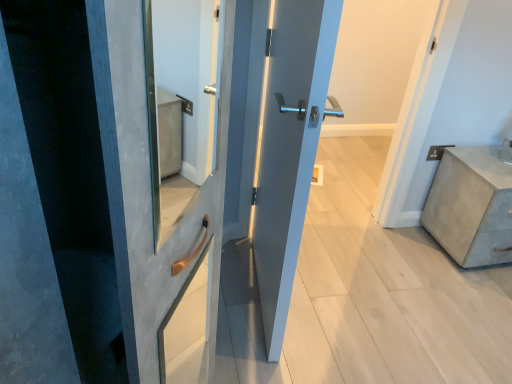
Locate an element on the screen. satin blue door at center is located at coordinates click(289, 146).

What do you see at coordinates (289, 146) in the screenshot? This screenshot has width=512, height=384. I see `satin blue door at center` at bounding box center [289, 146].

What is the approximate height of satin blue door at center?

4.20 feet.

This screenshot has width=512, height=384. Describe the element at coordinates (471, 206) in the screenshot. I see `concrete textured chest of drawers at right` at that location.

The image size is (512, 384). I want to click on concrete textured chest of drawers at right, so click(x=471, y=206).

At what (x,y) coordinates should I click in order to perform the action: click on satin blue door at center. Please return your answer as a coordinate pair (x, y). This screenshot has width=512, height=384. Looking at the image, I should click on (289, 146).

Considering the relative positions of concrete textured chest of drawers at right and satin blue door at center in the image provided, is concrete textured chest of drawers at right to the right of satin blue door at center from the viewer's perspective?

Yes.

Between concrete textured chest of drawers at right and satin blue door at center, which one is positioned behind?

Positioned behind is concrete textured chest of drawers at right.

Is point (443, 206) closer to camera compared to point (262, 148)?

No, (443, 206) is behind (262, 148).

From the image's perspective, relative to satin blue door at center, is concrete textured chest of drawers at right above or below?

concrete textured chest of drawers at right is below satin blue door at center.

From a real-world perspective, which object stands above the other?

In real-world perspective, satin blue door at center is above.

Can you confirm if concrete textured chest of drawers at right is thinner than satin blue door at center?

Incorrect, the width of concrete textured chest of drawers at right is not less than that of satin blue door at center.

Between concrete textured chest of drawers at right and satin blue door at center, which one has more height?

satin blue door at center is taller.

Does concrete textured chest of drawers at right have a smaller size compared to satin blue door at center?

No, concrete textured chest of drawers at right is not smaller than satin blue door at center.

Is concrete textured chest of drawers at right located outside satin blue door at center?

Yes, concrete textured chest of drawers at right is outside of satin blue door at center.

Can you see concrete textured chest of drawers at right touching satin blue door at center?

concrete textured chest of drawers at right and satin blue door at center are clearly separated.

Could you tell me if concrete textured chest of drawers at right is turned towards satin blue door at center?

No, concrete textured chest of drawers at right is not aimed at satin blue door at center.

How different are the orientations of concrete textured chest of drawers at right and satin blue door at center in degrees?

The angle between the facing direction of concrete textured chest of drawers at right and the facing direction of satin blue door at center is 82.6 degrees.

Identify the location of the chest of drawers that appears below the satin blue door at center (from a real-world perspective). (471, 206).

Considering the positions of objects satin blue door at center and concrete textured chest of drawers at right in the image provided, who is more to the left, satin blue door at center or concrete textured chest of drawers at right?

Positioned to the left is satin blue door at center.

Which object is further away from the camera taking this photo, satin blue door at center or concrete textured chest of drawers at right?

concrete textured chest of drawers at right.

Which point is more forward, (302, 13) or (437, 201)?

The point (302, 13) is closer.

From the picture: From the image's perspective, which is above, satin blue door at center or concrete textured chest of drawers at right?

satin blue door at center.

From a real-world perspective, does satin blue door at center stand above concrete textured chest of drawers at right?

Correct, in the physical world, satin blue door at center is higher than concrete textured chest of drawers at right.

Between satin blue door at center and concrete textured chest of drawers at right, which one has smaller width?

satin blue door at center is thinner.

Does satin blue door at center have a lesser height compared to concrete textured chest of drawers at right?

Incorrect, the height of satin blue door at center does not fall short of that of concrete textured chest of drawers at right.

Considering the sizes of objects satin blue door at center and concrete textured chest of drawers at right in the image provided, who is smaller, satin blue door at center or concrete textured chest of drawers at right?

satin blue door at center.

Is satin blue door at center surrounding concrete textured chest of drawers at right?

No, satin blue door at center does not contain concrete textured chest of drawers at right.

Are satin blue door at center and concrete textured chest of drawers at right beside each other?

No.

Could you tell me if satin blue door at center is facing concrete textured chest of drawers at right?

Yes, satin blue door at center is turned towards concrete textured chest of drawers at right.

Find the location of a particular element. The width and height of the screenshot is (512, 384). the chest of drawers behind the satin blue door at center is located at coordinates (471, 206).

This screenshot has width=512, height=384. I want to click on chest of drawers below the satin blue door at center (from the image's perspective), so click(471, 206).

This screenshot has height=384, width=512. In the image, there is a concrete textured chest of drawers at right. What are the coordinates of `door above it (from the image's perspective)` in the screenshot? It's located at (289, 146).